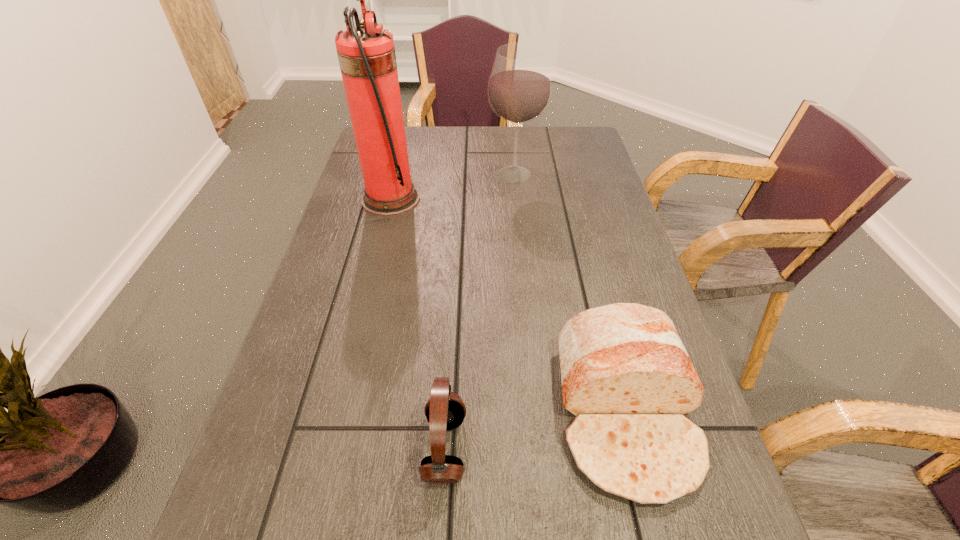
Locate an element on the screen. object that is at the right edge is located at coordinates (625, 374).

Locate an element on the screen. vacant area at the far edge of the desktop is located at coordinates (450, 127).

Where is `vacant space at the left edge of the desktop`? This screenshot has height=540, width=960. vacant space at the left edge of the desktop is located at coordinates (361, 210).

Where is `free space at the far right corner of the desktop`? The image size is (960, 540). free space at the far right corner of the desktop is located at coordinates (574, 125).

I want to click on empty space that is in between the leftmost object and the bread, so click(x=508, y=306).

Identify the location of vacant space in between the tallest object and the alcohol. (452, 187).

You are a GUI agent. You are given a task and a screenshot of the screen. Output one action in this format:
    pyautogui.click(x=<x>, y=<y>)
    Task: Click on the vacant area between the leftmost object and the bread
    The height and width of the screenshot is (540, 960).
    Given the screenshot: What is the action you would take?
    pyautogui.click(x=508, y=306)

Locate an element on the screen. empty space between the tallest object and the bread is located at coordinates (508, 306).

Identify the location of free space between the second tallest object and the third object from right to left. (480, 312).

At what (x,y) coordinates should I click in order to perform the action: click on unoccupied area between the bread and the second object from left to right. Please return your answer as a coordinate pair (x, y). This screenshot has width=960, height=540. Looking at the image, I should click on [536, 430].